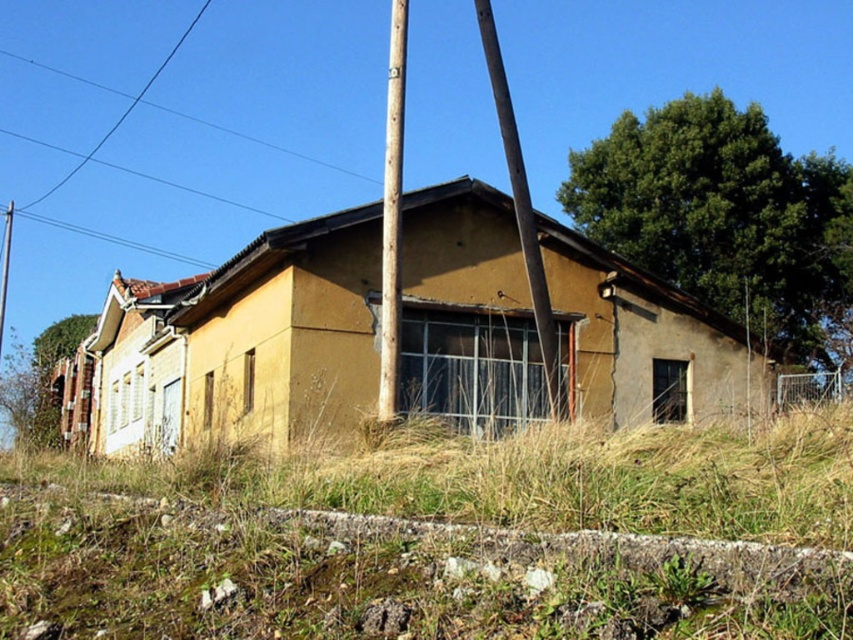
Does dry grass at lower center have a larger size compared to green leafy tree at upper left?

No, dry grass at lower center is not bigger than green leafy tree at upper left.

Between dry grass at lower center and green leafy tree at upper left, which one is positioned higher?

dry grass at lower center is above.

Does point (143, 515) come closer to viewer compared to point (74, 328)?

Yes, it is.

The width and height of the screenshot is (853, 640). What are the coordinates of `dry grass at lower center` in the screenshot? It's located at (438, 540).

Is wooden pole at center to the left of metallic pole at left from the viewer's perspective?

Incorrect, wooden pole at center is not on the left side of metallic pole at left.

Which is above, wooden pole at center or metallic pole at left?

wooden pole at center

Between point (546, 298) and point (0, 314), which one is positioned behind?

The point (0, 314) is behind.

Find the location of a particular element. The width and height of the screenshot is (853, 640). wooden pole at center is located at coordinates (520, 202).

Is point (393, 234) closer to viewer compared to point (67, 333)?

Yes.

How far apart are brown wooden pole at center and green leafy tree at upper left?

33.81 meters

Is point (396, 308) more distant than point (64, 326)?

No.

This screenshot has height=640, width=853. I want to click on brown wooden pole at center, so click(x=392, y=214).